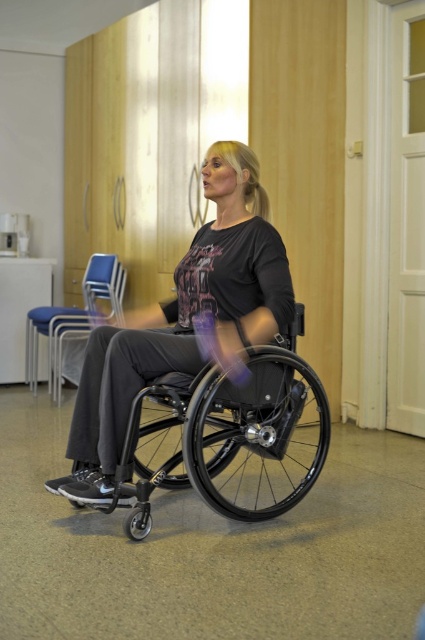
Question: Observing the image, what is the correct spatial positioning of matte black wheelchair at center in reference to blue fabric chair at center?

Choices:
 (A) right
 (B) left

Answer: (A)

Question: Observing the image, what is the correct spatial positioning of matte black wheelchair at center in reference to blue fabric chair at center?

Choices:
 (A) right
 (B) left

Answer: (A)

Question: Which object is farther from the camera taking this photo?

Choices:
 (A) matte black wheelchair at center
 (B) black plastic wheelchair at center

Answer: (A)

Question: Does matte black wheelchair at center have a lesser width compared to black plastic wheelchair at center?

Choices:
 (A) no
 (B) yes

Answer: (B)

Question: Which point is closer to the camera?

Choices:
 (A) click(x=198, y=317)
 (B) click(x=85, y=291)
 (C) click(x=212, y=477)

Answer: (A)

Question: Which point is farther to the camera?

Choices:
 (A) (65, 477)
 (B) (121, 296)
 (C) (150, 440)

Answer: (B)